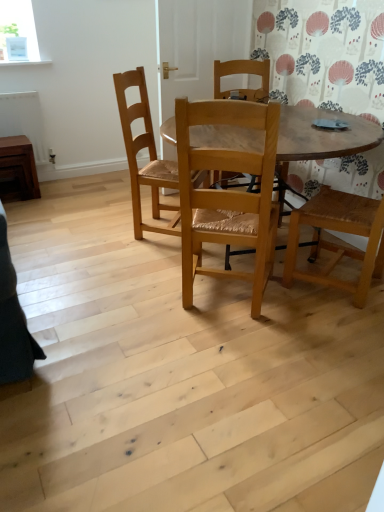
Question: From the image's perspective, is natural wood chair at center, marked as the 2th chair in a back-to-front arrangement, under brown wooden side table at left?

Choices:
 (A) no
 (B) yes

Answer: (B)

Question: Is natural wood chair at center, the 1th chair in the front-to-back sequence, bigger than brown wooden side table at left?

Choices:
 (A) yes
 (B) no

Answer: (A)

Question: Can you confirm if natural wood chair at center, the 1th chair in the front-to-back sequence, is thinner than brown wooden side table at left?

Choices:
 (A) yes
 (B) no

Answer: (B)

Question: From the image's perspective, does natural wood chair at center, the 1th chair in the front-to-back sequence, appear higher than brown wooden side table at left?

Choices:
 (A) yes
 (B) no

Answer: (B)

Question: Does natural wood chair at center, marked as the 2th chair in a back-to-front arrangement, lie in front of brown wooden side table at left?

Choices:
 (A) yes
 (B) no

Answer: (A)

Question: Is natural wood chair at center, marked as the 2th chair in a back-to-front arrangement, not inside brown wooden side table at left?

Choices:
 (A) yes
 (B) no

Answer: (A)

Question: From the image's perspective, is natural wood chair at center, which is counted as the first chair, starting from the back, above brown wooden radiator at left?

Choices:
 (A) yes
 (B) no

Answer: (B)

Question: Is natural wood chair at center, positioned as the 2th chair in front-to-back order, next to brown wooden radiator at left?

Choices:
 (A) yes
 (B) no

Answer: (B)

Question: Is the position of natural wood chair at center, positioned as the 2th chair in front-to-back order, more distant than that of brown wooden radiator at left?

Choices:
 (A) no
 (B) yes

Answer: (A)

Question: Is natural wood chair at center, which is counted as the first chair, starting from the back, oriented away from brown wooden radiator at left?

Choices:
 (A) no
 (B) yes

Answer: (A)

Question: Would you say natural wood chair at center, positioned as the 2th chair in front-to-back order, is outside brown wooden radiator at left?

Choices:
 (A) yes
 (B) no

Answer: (A)

Question: Considering the relative positions of natural wood chair at center, which is counted as the first chair, starting from the back, and brown wooden radiator at left in the image provided, is natural wood chair at center, which is counted as the first chair, starting from the back, to the right of brown wooden radiator at left from the viewer's perspective?

Choices:
 (A) yes
 (B) no

Answer: (A)

Question: Is brown wooden side table at left positioned with its back to natural wood chair at center, the 1th chair in the front-to-back sequence?

Choices:
 (A) no
 (B) yes

Answer: (A)